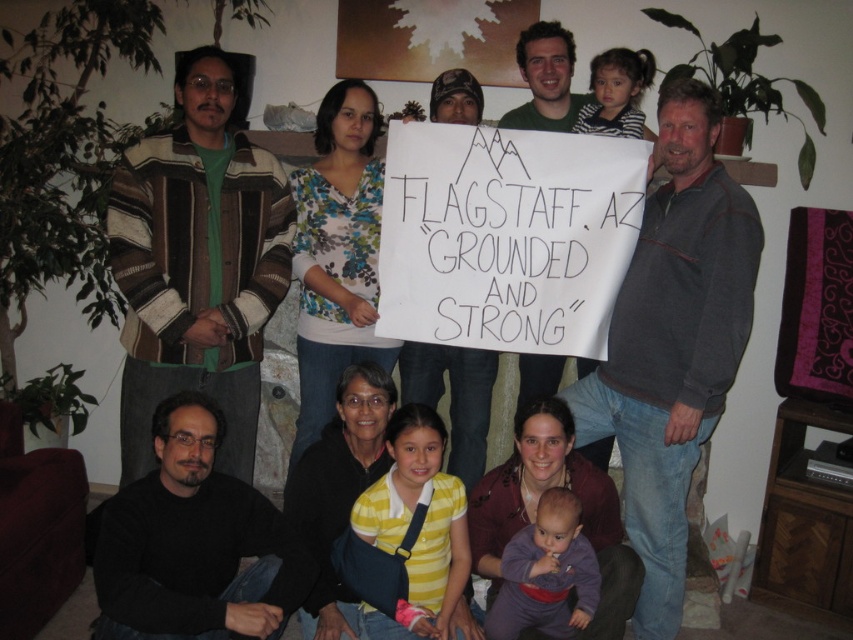
You are a fashion designer observing the group and want to create a matching accessory for both the striped wool sweater at left and the yellow striped shirt at center. Considering their sizes, which one would require a larger accessory?

The striped wool sweater at left requires a larger accessory because it has a larger size compared to the yellow striped shirt at center.

You are a photographer trying to capture a clear shot of the striped wool sweater at left and the purple fleece baby at lower center. Which object is closer to you, the photographer?

The striped wool sweater at left is closer to you because it is further to the viewer than the purple fleece baby at lower center.